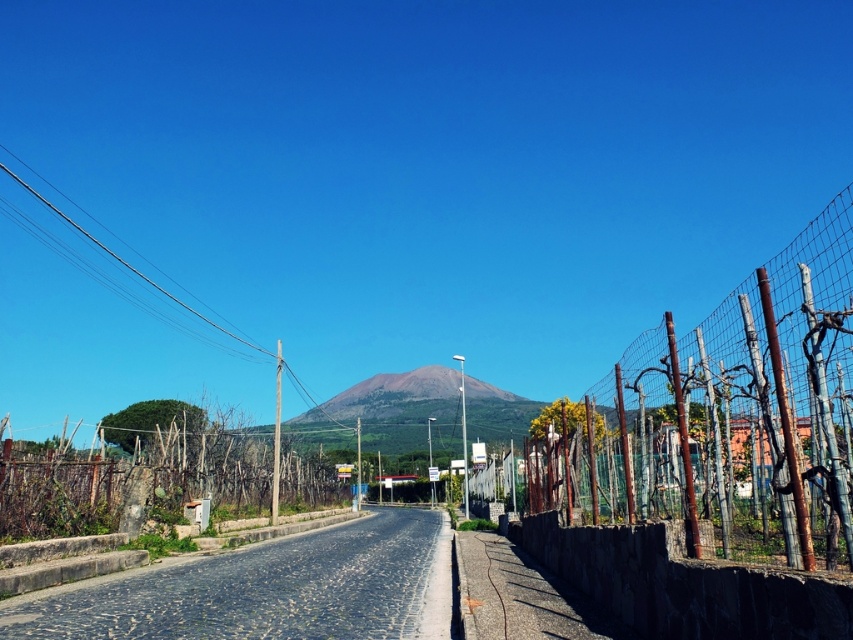
Between rusty wire mesh fence at right and wire mesh fence at center, which one has less height?

wire mesh fence at center is shorter.

Is point (712, 380) closer to viewer compared to point (297, 464)?

Yes, point (712, 380) is closer to viewer.

Which is in front, point (831, 560) or point (186, 481)?

Point (831, 560) is in front.

Where is `rusty wire mesh fence at right`? This screenshot has height=640, width=853. rusty wire mesh fence at right is located at coordinates point(724,413).